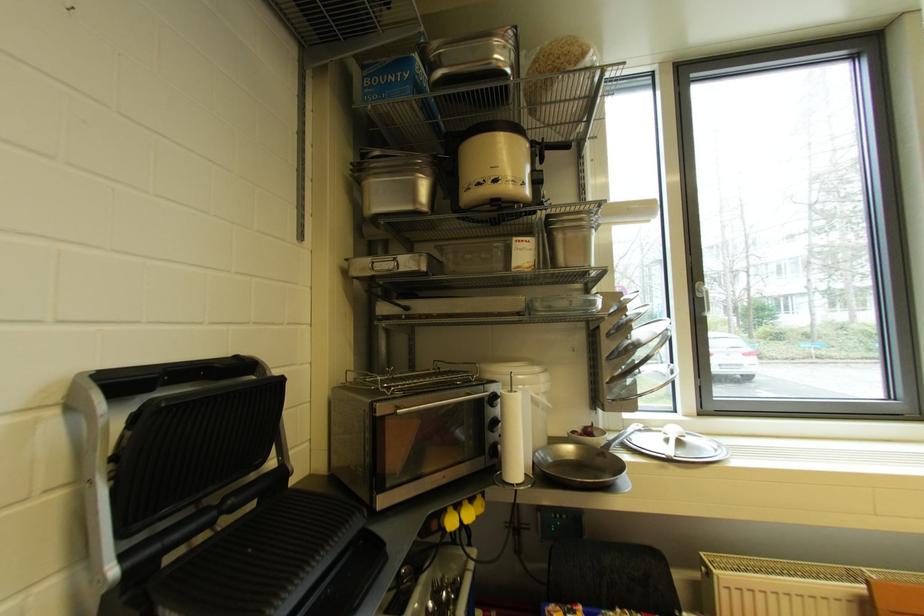
Where is `metal canister lid`? The width and height of the screenshot is (924, 616). metal canister lid is located at coordinates (676, 445).